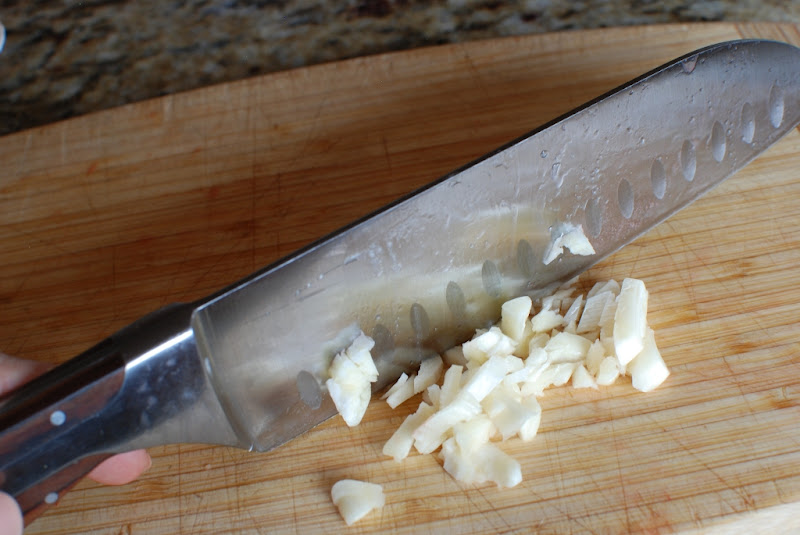
Where is `cutting board`? cutting board is located at coordinates (54, 175).